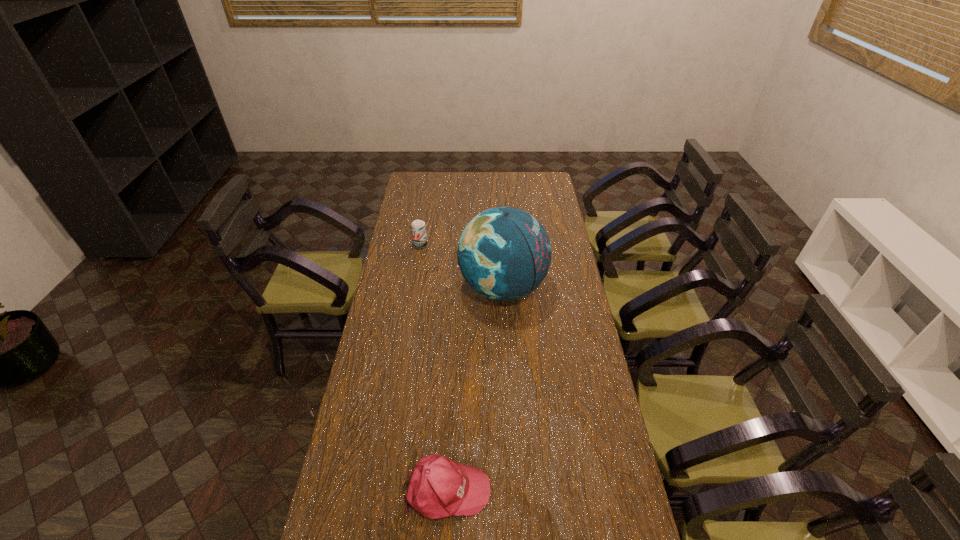
This screenshot has width=960, height=540. I want to click on globe, so click(504, 253).

Where is `the tallest object`? the tallest object is located at coordinates (504, 253).

The height and width of the screenshot is (540, 960). In order to click on beer can in this screenshot , I will do `click(418, 227)`.

Locate an element on the screen. the farthest object is located at coordinates (418, 227).

Identify the location of the nearest object. The image size is (960, 540). (438, 487).

This screenshot has width=960, height=540. In order to click on vacant space located on the left of the globe in this screenshot , I will do `click(396, 288)`.

What are the coordinates of `vacant space located 0.280m on the right of the farthest object` in the screenshot? It's located at (487, 245).

Find the location of a particular element. This screenshot has height=540, width=960. free region located 0.230m at the front of the baseball cap with the brim is located at coordinates (571, 489).

The height and width of the screenshot is (540, 960). Find the location of `object that is at the left edge`. object that is at the left edge is located at coordinates (418, 227).

You are a GUI agent. You are given a task and a screenshot of the screen. Output one action in this format:
    pyautogui.click(x=<x>, y=<y>)
    Task: Click on the object that is at the right edge
    
    Given the screenshot: What is the action you would take?
    pyautogui.click(x=504, y=253)